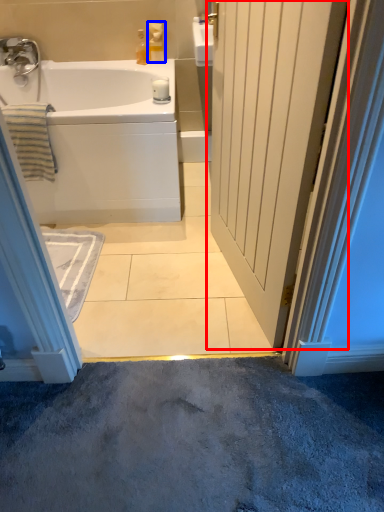
Question: Among these objects, which one is farthest to the camera, door (highlighted by a red box) or toiletry (highlighted by a blue box)?

Choices:
 (A) door
 (B) toiletry

Answer: (B)